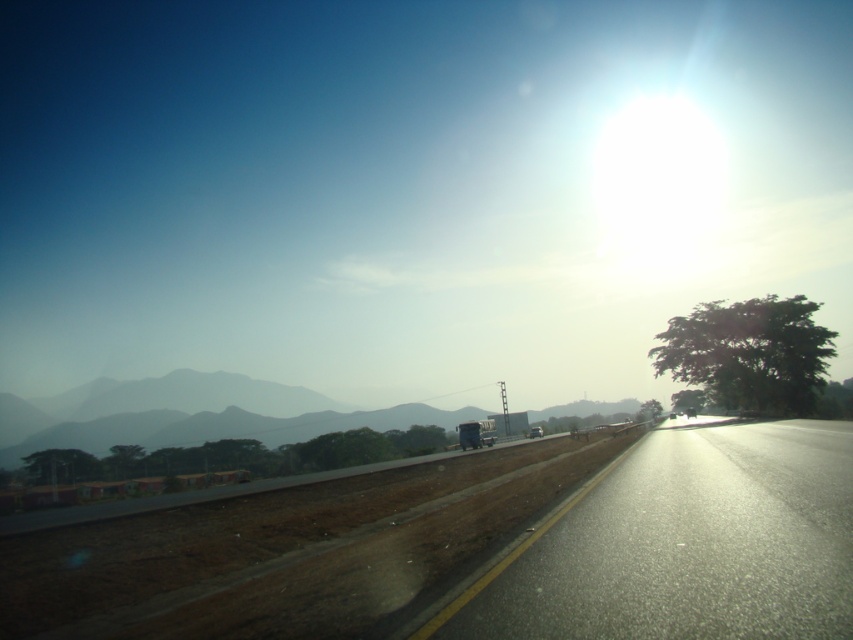
Question: Is black asphalt highway at center below metallic silver car at center?

Choices:
 (A) no
 (B) yes

Answer: (A)

Question: Which object appears farthest from the camera in this image?

Choices:
 (A) metallic blue trailer truck at center
 (B) metallic silver car at center

Answer: (B)

Question: Among these objects, which one is nearest to the camera?

Choices:
 (A) metallic blue trailer truck at center
 (B) metallic silver car at center

Answer: (A)

Question: Can you confirm if metallic blue trailer truck at center is thinner than metallic silver car at center?

Choices:
 (A) no
 (B) yes

Answer: (B)

Question: Which point is farther to the camera?

Choices:
 (A) (535, 433)
 (B) (463, 433)

Answer: (A)

Question: Does black asphalt highway at center lie in front of metallic blue trailer truck at center?

Choices:
 (A) yes
 (B) no

Answer: (A)